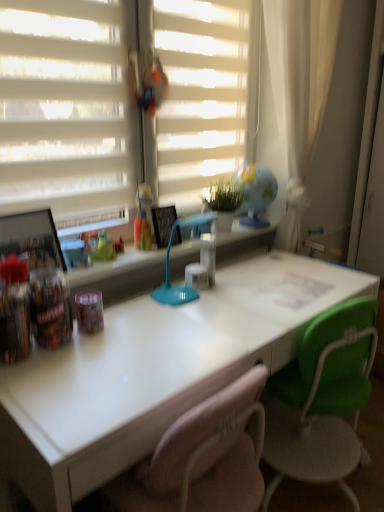
Where is `empty space that is to the right of blue plastic table lamp at center`? Image resolution: width=384 pixels, height=512 pixels. empty space that is to the right of blue plastic table lamp at center is located at coordinates (248, 303).